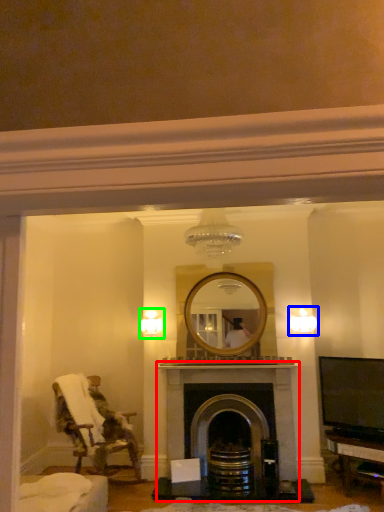
Question: Which object is the farthest from fireplace (highlighted by a red box)? Choose among these: light fixture (highlighted by a blue box) or light fixture (highlighted by a green box).

Choices:
 (A) light fixture
 (B) light fixture

Answer: (B)